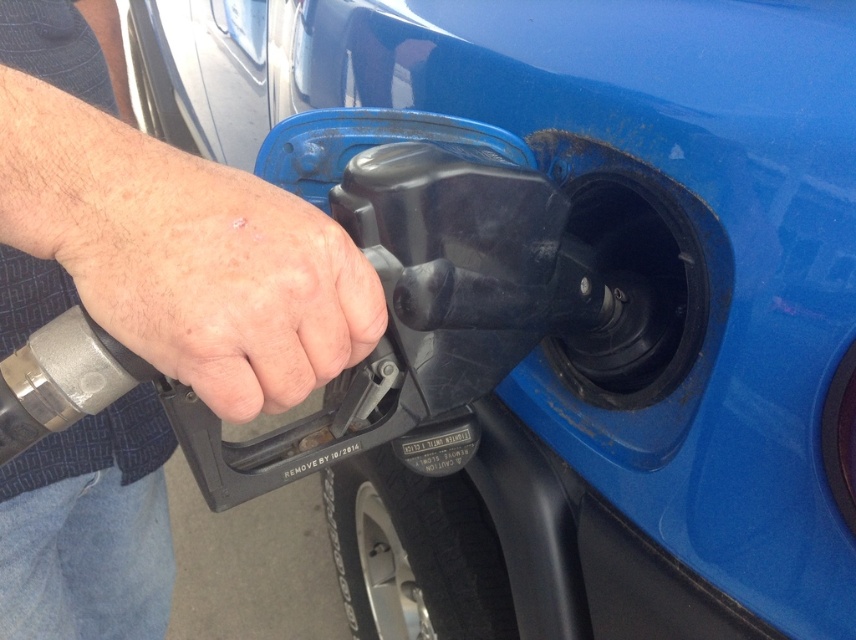
Who is positioned more to the left, gray matte fuel nozzle at center or dry skin at center?

gray matte fuel nozzle at center

Can you confirm if gray matte fuel nozzle at center is positioned to the left of dry skin at center?

Yes, gray matte fuel nozzle at center is to the left of dry skin at center.

Identify the location of gray matte fuel nozzle at center. The height and width of the screenshot is (640, 856). (159, 230).

I want to click on gray matte fuel nozzle at center, so click(159, 230).